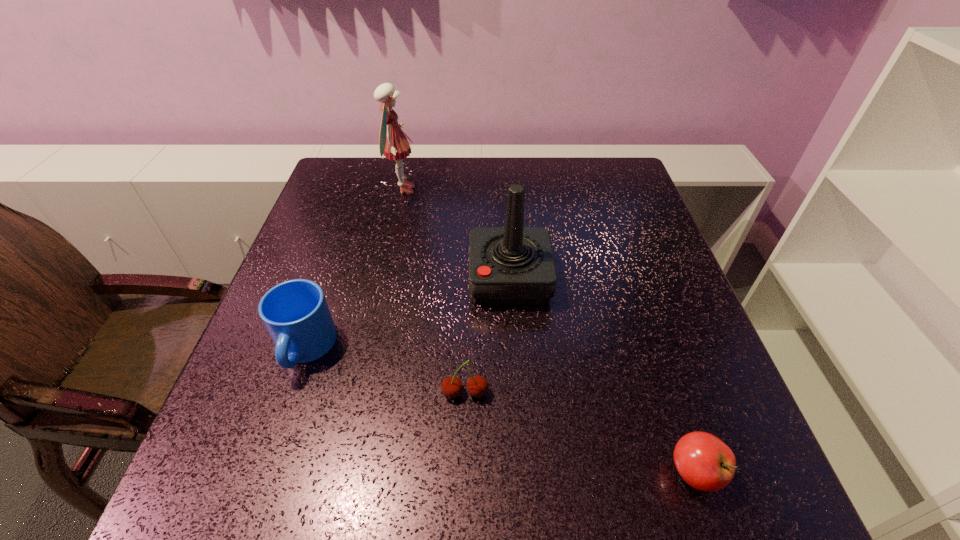
The width and height of the screenshot is (960, 540). What are the coordinates of `vacant region located on the front-facing side of the fourth nearest object` in the screenshot? It's located at (316, 279).

At what (x,y) coordinates should I click in order to perform the action: click on vacant point located on the front-facing side of the fourth nearest object. Please return your answer as a coordinate pair (x, y). Looking at the image, I should click on (338, 279).

What are the coordinates of `vacant area situated 0.150m on the side of the mug with the handle` in the screenshot? It's located at (265, 465).

In order to click on vacant point located 0.050m on the surface of the cherry in this screenshot , I will do (x=465, y=430).

Identify the location of vacant space located on the left of the rightmost object. (435, 472).

I want to click on object located in the far edge section of the desktop, so click(393, 144).

Where is `object that is at the near edge`? object that is at the near edge is located at coordinates (705, 462).

Image resolution: width=960 pixels, height=540 pixels. I want to click on object situated at the left edge, so click(x=295, y=313).

Identify the location of object located at the right edge. Image resolution: width=960 pixels, height=540 pixels. (705, 462).

Identify the location of object present at the near right corner. (705, 462).